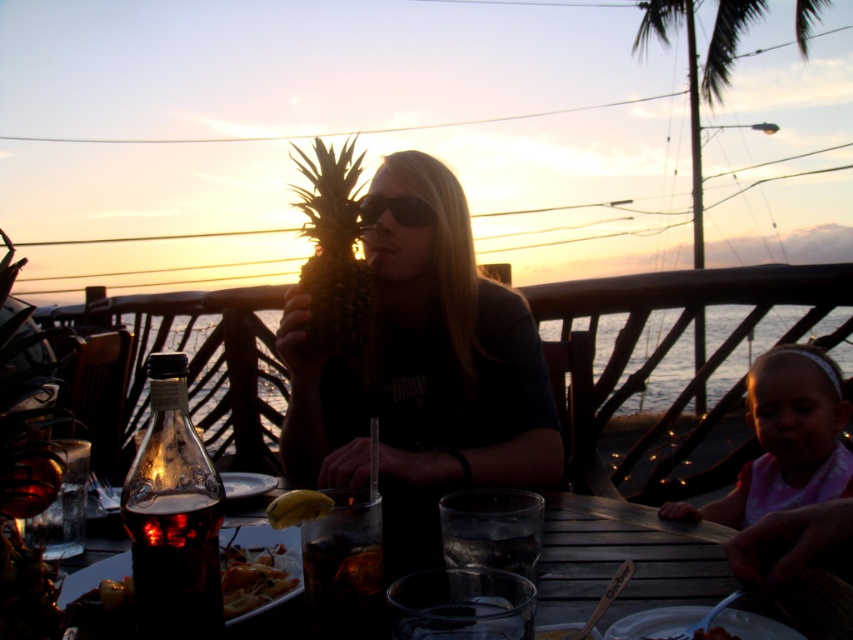
Between transparent glass table at center and shiny glass bottle at lower left, which one has less height?

shiny glass bottle at lower left is shorter.

Which is behind, point (260, 516) or point (129, 570)?

The point (260, 516) is more distant.

You are a GUI agent. You are given a task and a screenshot of the screen. Output one action in this format:
    pyautogui.click(x=<x>, y=<y>)
    Task: Click on the transparent glass table at center
    The image size is (853, 640).
    Given the screenshot: What is the action you would take?
    pyautogui.click(x=625, y=557)

Does pink fabric headband at lower right lie in front of green leafy palm tree at upper right?

Result: Yes, it is in front of green leafy palm tree at upper right.

Is point (781, 436) in front of point (699, 184)?

Yes.

Find the location of a particular element. The image size is (853, 640). pink fabric headband at lower right is located at coordinates (785, 440).

Can you confirm if black plastic sunglasses at center is positioned below yellow matte banana at center?

Incorrect, black plastic sunglasses at center is not positioned below yellow matte banana at center.

Does black plastic sunglasses at center have a smaller size compared to yellow matte banana at center?

No, black plastic sunglasses at center is not smaller than yellow matte banana at center.

Identify the location of black plastic sunglasses at center. point(395,211).